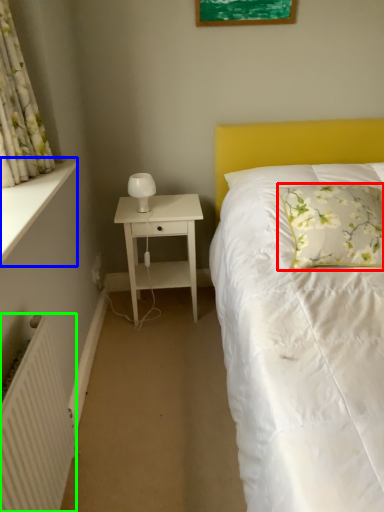
Question: Based on their relative distances, which object is nearer to pillow (highlighted by a red box)? Choose from window sill (highlighted by a blue box) and radiator (highlighted by a green box).

Choices:
 (A) window sill
 (B) radiator

Answer: (A)